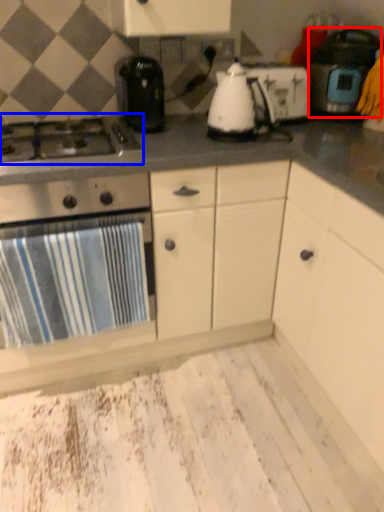
Question: Which object appears closest to the camera in this image, kitchen appliance (highlighted by a red box) or gas stove (highlighted by a blue box)?

Choices:
 (A) kitchen appliance
 (B) gas stove

Answer: (B)